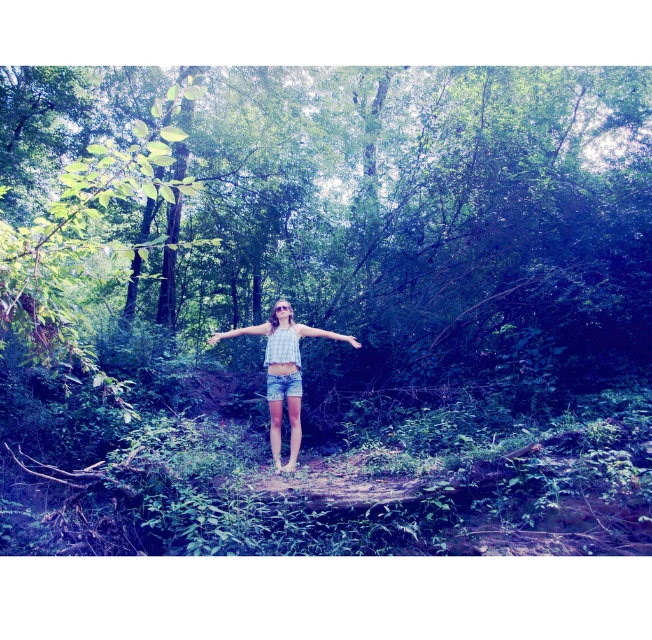
Question: Is the position of checkered fabric blouse at center less distant than that of denim shorts at center?

Choices:
 (A) no
 (B) yes

Answer: (B)

Question: Can you confirm if white fabric arm at center is positioned to the right of matte white arm at center?

Choices:
 (A) yes
 (B) no

Answer: (A)

Question: Is white fabric arm at center above smooth skin hand at center?

Choices:
 (A) yes
 (B) no

Answer: (A)

Question: Which object appears closest to the camera in this image?

Choices:
 (A) checkered fabric blouse at center
 (B) denim shorts at center

Answer: (A)

Question: Which object is farther from the camera taking this photo?

Choices:
 (A) checkered fabric blouse at center
 (B) blue fabric hand at center
 (C) matte white arm at center
 (D) smooth skin hand at center

Answer: (C)

Question: Which of the following is the farthest from the observer?

Choices:
 (A) (228, 332)
 (B) (348, 339)
 (C) (348, 339)
 (D) (299, 408)

Answer: (A)